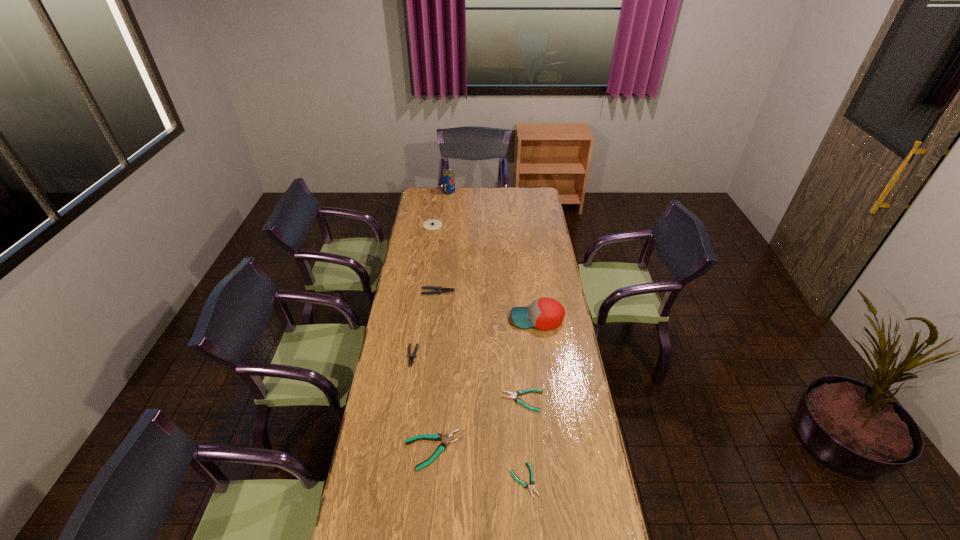
This screenshot has height=540, width=960. I want to click on the tallest object, so click(x=448, y=179).

You are a GUI agent. You are given a task and a screenshot of the screen. Output one action in this format:
    pyautogui.click(x=<x>, y=<y>)
    Task: Click on the farthest object
    The image size is (960, 540).
    Given the screenshot: What is the action you would take?
    pyautogui.click(x=448, y=179)

Locate an element on the screen. This screenshot has width=960, height=540. the second tallest object is located at coordinates (545, 313).

Where is `red baseball cap`? The width and height of the screenshot is (960, 540). red baseball cap is located at coordinates (545, 313).

Where is `compass`? The height and width of the screenshot is (540, 960). compass is located at coordinates (433, 224).

Locate an element on the screen. This screenshot has width=960, height=540. the second farthest object is located at coordinates (433, 224).

Image resolution: width=960 pixels, height=540 pixels. Find the location of `the tallest pliers`. the tallest pliers is located at coordinates (438, 290).

You are a GUI agent. You are given a task and a screenshot of the screen. Output one action in this format:
    pyautogui.click(x=<x>, y=<y>)
    Task: Click on the bigger gray pliers
    This screenshot has width=960, height=540.
    Given the screenshot: What is the action you would take?
    pyautogui.click(x=438, y=290)

Locate an element on the screen. This screenshot has width=960, height=540. the second farthest pliers is located at coordinates (411, 358).

Identify the location of the smaller gray pliers. This screenshot has height=540, width=960. (411, 358).